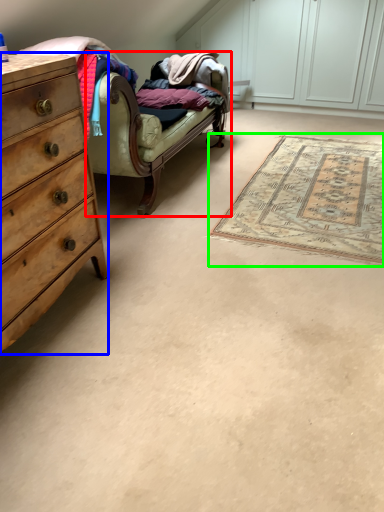
Question: Which is nearer to the studio couch (highlighted by a red box)? chest of drawers (highlighted by a blue box) or mat (highlighted by a green box).

Choices:
 (A) chest of drawers
 (B) mat

Answer: (B)